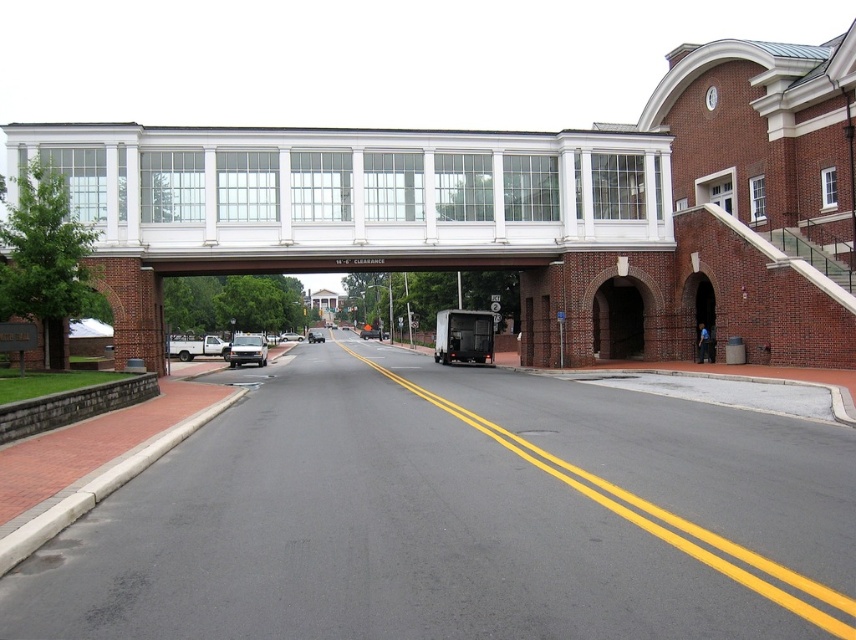
Who is positioned more to the right, silver metallic van at center or silver metallic sedan at center?

silver metallic van at center is more to the right.

At what (x,y) coordinates should I click in order to perform the action: click on silver metallic van at center. Please return your answer as a coordinate pair (x, y). The image size is (856, 640). Looking at the image, I should click on (247, 349).

Where is `silver metallic van at center`? This screenshot has width=856, height=640. silver metallic van at center is located at coordinates (247, 349).

Measure the distance between point (325, 168) and camera.

Point (325, 168) and camera are 31.30 meters apart from each other.

Can you confirm if white glass bridge at upper center is wider than matte black truck at center?

Correct, the width of white glass bridge at upper center exceeds that of matte black truck at center.

Does point (663, 241) lie behind point (366, 330)?

No, it is not.

This screenshot has height=640, width=856. In order to click on white glass bridge at upper center in this screenshot , I will do `click(354, 195)`.

Does white glass bridge at upper center appear on the right side of matte white truck at center?

Correct, you'll find white glass bridge at upper center to the right of matte white truck at center.

From the picture: Between white glass bridge at upper center and matte white truck at center, which one is positioned higher?

white glass bridge at upper center is above.

This screenshot has height=640, width=856. I want to click on white glass bridge at upper center, so click(x=354, y=195).

Where is `white glass bridge at upper center`? white glass bridge at upper center is located at coordinates (354, 195).